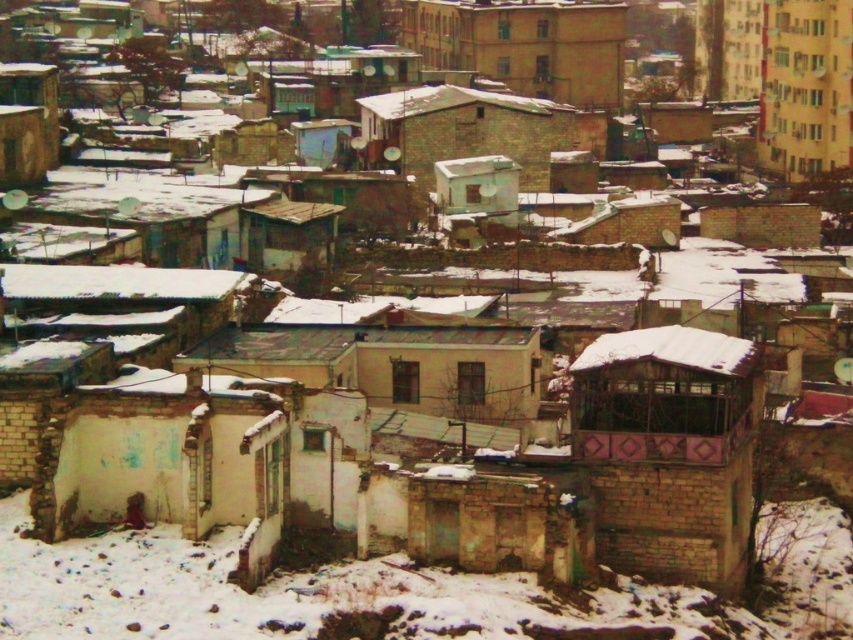
Based on the photo, you are a city planner analyzing the urban layout. Given the beige concrete building at upper center and the brown brick hut at center, which structure has a greater horizontal span when viewed from above?

The beige concrete building at upper center has a greater horizontal span than the brown brick hut at center because its width is larger.